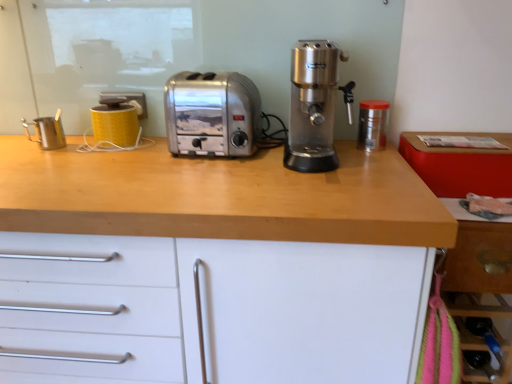
Question: Is yellow matte mug at upper left, which is the 2th kitchen appliance in left-to-right order, directly adjacent to satin silver coffee machine at center?

Choices:
 (A) no
 (B) yes

Answer: (A)

Question: From a real-world perspective, is yellow matte mug at upper left, which is the 2th kitchen appliance in left-to-right order, over satin silver coffee machine at center?

Choices:
 (A) no
 (B) yes

Answer: (A)

Question: Is yellow matte mug at upper left, which is the 2th kitchen appliance in left-to-right order, oriented away from satin silver coffee machine at center?

Choices:
 (A) yes
 (B) no

Answer: (B)

Question: From the image's perspective, is yellow matte mug at upper left, which ranks as the second kitchen appliance in right-to-left order, located above satin silver coffee machine at center?

Choices:
 (A) no
 (B) yes

Answer: (A)

Question: Can you confirm if yellow matte mug at upper left, which is the 2th kitchen appliance in left-to-right order, is thinner than satin silver coffee machine at center?

Choices:
 (A) yes
 (B) no

Answer: (A)

Question: Is yellow matte mug at upper left, which ranks as the second kitchen appliance in right-to-left order, outside of satin silver coffee machine at center?

Choices:
 (A) yes
 (B) no

Answer: (A)

Question: Can you confirm if metallic stainless steel pitcher at left, which ranks as the first kitchen appliance in left-to-right order, is smaller than satin silver coffee machine at center?

Choices:
 (A) yes
 (B) no

Answer: (A)

Question: Is metallic stainless steel pitcher at left, which ranks as the first kitchen appliance in left-to-right order, outside satin silver coffee machine at center?

Choices:
 (A) no
 (B) yes

Answer: (B)

Question: From the image's perspective, would you say metallic stainless steel pitcher at left, which ranks as the first kitchen appliance in left-to-right order, is shown under satin silver coffee machine at center?

Choices:
 (A) yes
 (B) no

Answer: (A)

Question: Is metallic stainless steel pitcher at left, positioned as the third kitchen appliance in right-to-left order, not close to satin silver coffee machine at center?

Choices:
 (A) no
 (B) yes

Answer: (A)

Question: Considering the relative sizes of metallic stainless steel pitcher at left, which ranks as the first kitchen appliance in left-to-right order, and satin silver coffee machine at center in the image provided, is metallic stainless steel pitcher at left, which ranks as the first kitchen appliance in left-to-right order, taller than satin silver coffee machine at center?

Choices:
 (A) yes
 (B) no

Answer: (B)

Question: From a real-world perspective, is metallic stainless steel pitcher at left, which ranks as the first kitchen appliance in left-to-right order, located beneath satin silver coffee machine at center?

Choices:
 (A) no
 (B) yes

Answer: (B)

Question: Does yellow matte mug at upper left, which ranks as the second kitchen appliance in right-to-left order, have a larger size compared to satin silver toaster at center?

Choices:
 (A) no
 (B) yes

Answer: (A)